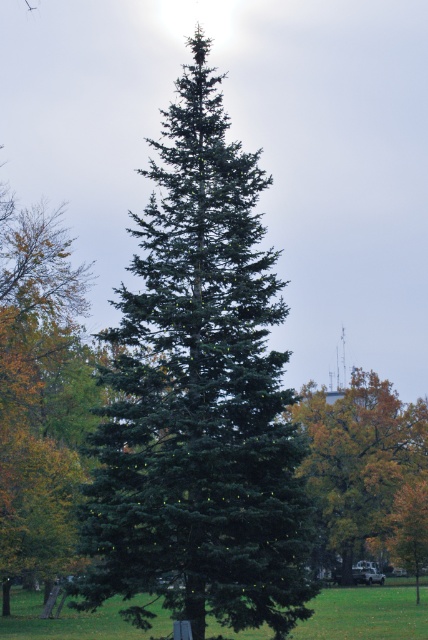
Question: Among these points, which one is farthest from the camera?

Choices:
 (A) (181, 381)
 (B) (368, 516)

Answer: (B)

Question: Does green matte tree at center have a smaller size compared to green grass at center?

Choices:
 (A) yes
 (B) no

Answer: (A)

Question: Estimate the real-world distances between objects in this image. Which object is closer to the golden yellow leaves at center?

Choices:
 (A) green grass at center
 (B) green matte tree at center

Answer: (A)

Question: Can you confirm if green matte tree at center is bigger than green grass at center?

Choices:
 (A) yes
 (B) no

Answer: (B)

Question: Can you confirm if golden yellow leaves at center is positioned to the left of green grass at center?

Choices:
 (A) yes
 (B) no

Answer: (B)

Question: Which of these objects is positioned closest to the green matte tree at center?

Choices:
 (A) green grass at center
 (B) golden yellow leaves at center

Answer: (A)